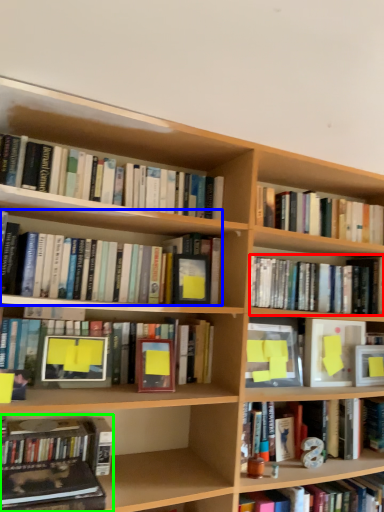
Question: Which object is positioned closest to book (highlighted by a red box)? Select from book (highlighted by a blue box) and book (highlighted by a green box).

Choices:
 (A) book
 (B) book

Answer: (A)